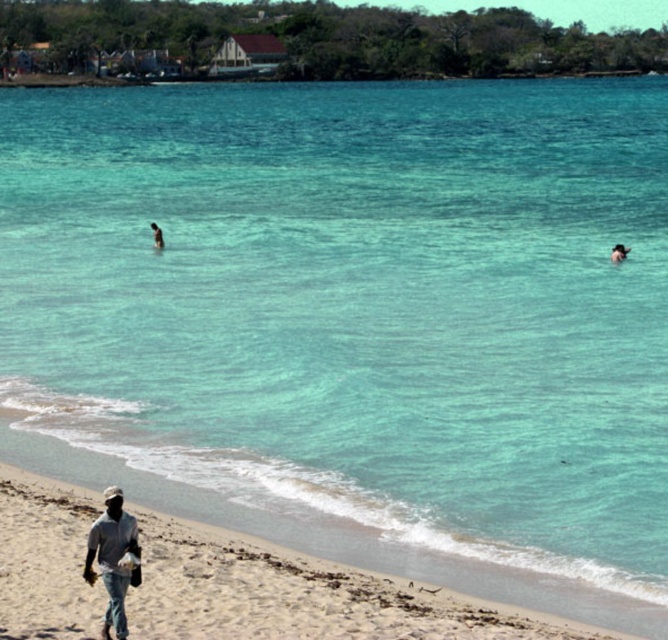
Question: Which of the following is the farthest from the observer?

Choices:
 (A) smooth skin person at upper right
 (B) dark skin human at center

Answer: (B)

Question: Among these points, which one is nearest to the camera?

Choices:
 (A) (162, 241)
 (B) (623, 252)
 (C) (106, 548)

Answer: (C)

Question: Does smooth skin person at upper right appear over dark skin human at center?

Choices:
 (A) yes
 (B) no

Answer: (B)

Question: Which object appears farthest from the camera in this image?

Choices:
 (A) dark skin human at center
 (B) smooth skin person at upper right
 (C) gray matte shirt at lower left

Answer: (A)

Question: Observing the image, what is the correct spatial positioning of smooth skin person at upper right in reference to dark skin human at center?

Choices:
 (A) right
 (B) left

Answer: (A)

Question: Is gray matte shirt at lower left further to the viewer compared to smooth skin person at upper right?

Choices:
 (A) yes
 (B) no

Answer: (B)